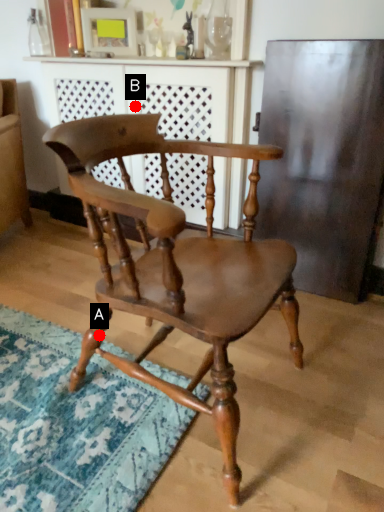
Question: Two points are circled on the image, labeled by A and B beside each circle. Which point is farther to the camera?

Choices:
 (A) A is further
 (B) B is further

Answer: (B)